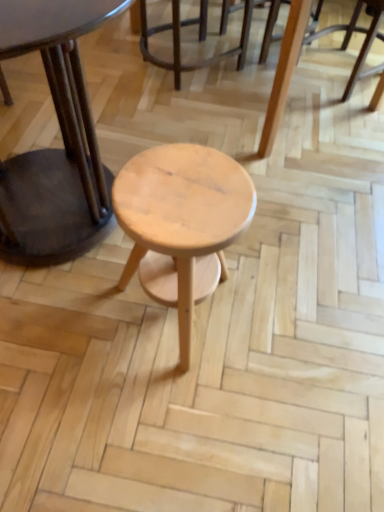
Question: In terms of height, does matte black table at center look taller or shorter compared to light brown wood chair at center?

Choices:
 (A) tall
 (B) short

Answer: (A)

Question: Looking at the image, does matte black table at center seem bigger or smaller compared to light brown wood chair at center?

Choices:
 (A) big
 (B) small

Answer: (A)

Question: Which object is positioned farthest from the natural wood stool at center?

Choices:
 (A) light brown wood chair at center
 (B) matte black table at center

Answer: (A)

Question: Estimate the real-world distances between objects in this image. Which object is closer to the natural wood stool at center?

Choices:
 (A) light brown wood chair at center
 (B) matte black table at center

Answer: (B)